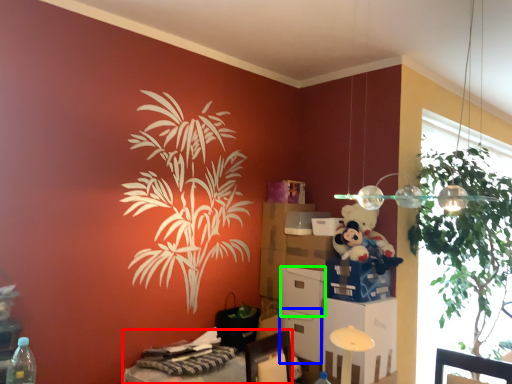
Question: Which object is the closest to the desk (highlighted by a red box)? Choose among these: box (highlighted by a blue box) or box (highlighted by a green box).

Choices:
 (A) box
 (B) box

Answer: (A)